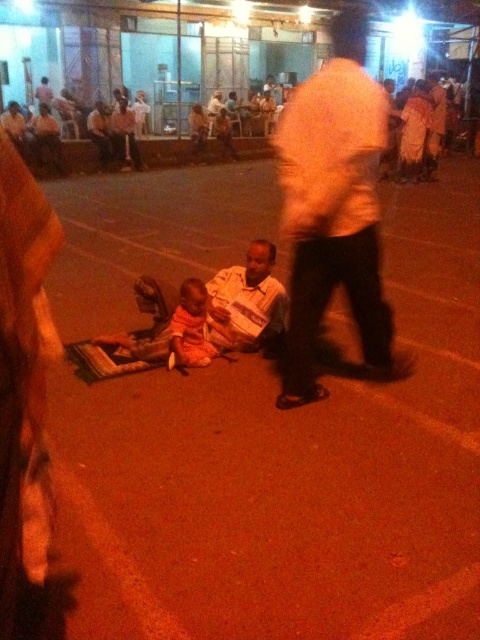
You are a photographer trying to capture a candid shot of the two people in the center of the nighttime scene. Since both are wearing white shirts, how can you distinguish between the white matte shirt at center and the white striped shirt at center in your photo?

The white matte shirt at center is positioned on the right side of the white striped shirt at center, so you can distinguish them by their relative positions.